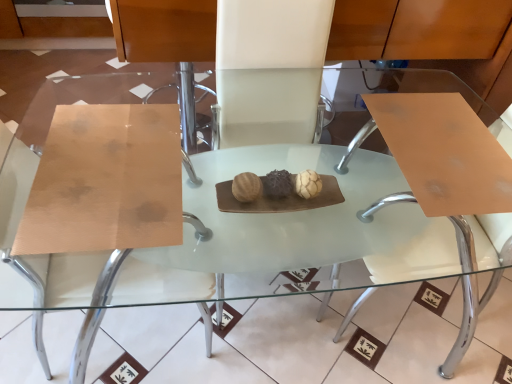
Question: Is white leather chair at center, which is the 1th chair in right-to-left order, smaller than matte wood chair at center, which appears as the 1th chair when viewed from the left?

Choices:
 (A) no
 (B) yes

Answer: (B)

Question: Does white leather chair at center, which is the 1th chair in right-to-left order, touch matte wood chair at center, which appears as the 1th chair when viewed from the left?

Choices:
 (A) yes
 (B) no

Answer: (B)

Question: From a real-world perspective, does white leather chair at center, placed as the second chair when sorted from left to right, sit lower than matte wood chair at center, which appears as the 2th chair when viewed from the right?

Choices:
 (A) yes
 (B) no

Answer: (B)

Question: Is white leather chair at center, which is the 1th chair in right-to-left order, not within matte wood chair at center, which appears as the 1th chair when viewed from the left?

Choices:
 (A) no
 (B) yes

Answer: (B)

Question: Would you consider white leather chair at center, which is the 1th chair in right-to-left order, to be distant from matte wood chair at center, which appears as the 2th chair when viewed from the right?

Choices:
 (A) yes
 (B) no

Answer: (B)

Question: Considering the relative sizes of white leather chair at center, placed as the second chair when sorted from left to right, and matte wood chair at center, which appears as the 2th chair when viewed from the right, in the image provided, is white leather chair at center, placed as the second chair when sorted from left to right, thinner than matte wood chair at center, which appears as the 2th chair when viewed from the right,?

Choices:
 (A) no
 (B) yes

Answer: (B)

Question: Is matte brown swivel chair at right thinner than white leather chair at center, placed as the second chair when sorted from left to right?

Choices:
 (A) no
 (B) yes

Answer: (A)

Question: From a real-world perspective, does matte brown swivel chair at right stand above white leather chair at center, which is the 1th chair in right-to-left order?

Choices:
 (A) yes
 (B) no

Answer: (B)

Question: Is the surface of matte brown swivel chair at right in direct contact with white leather chair at center, which is the 1th chair in right-to-left order?

Choices:
 (A) no
 (B) yes

Answer: (A)

Question: Is matte brown swivel chair at right oriented away from white leather chair at center, which is the 1th chair in right-to-left order?

Choices:
 (A) no
 (B) yes

Answer: (B)

Question: Is matte brown swivel chair at right closer to camera compared to white leather chair at center, placed as the second chair when sorted from left to right?

Choices:
 (A) yes
 (B) no

Answer: (A)

Question: Is matte brown swivel chair at right bigger than white leather chair at center, placed as the second chair when sorted from left to right?

Choices:
 (A) yes
 (B) no

Answer: (B)

Question: Would you say matte brown swivel chair at right is part of matte wood chair at center, which appears as the 2th chair when viewed from the right,'s contents?

Choices:
 (A) yes
 (B) no

Answer: (B)